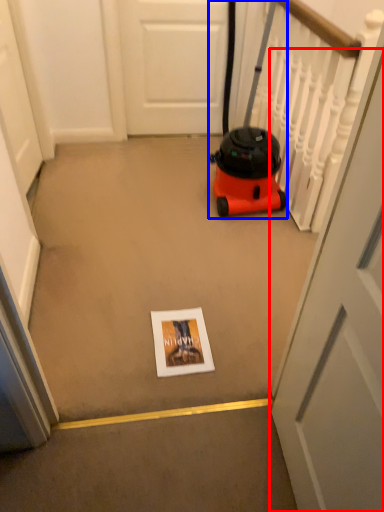
Question: Which object appears closest to the camera in this image, door (highlighted by a red box) or equipment (highlighted by a blue box)?

Choices:
 (A) door
 (B) equipment

Answer: (A)